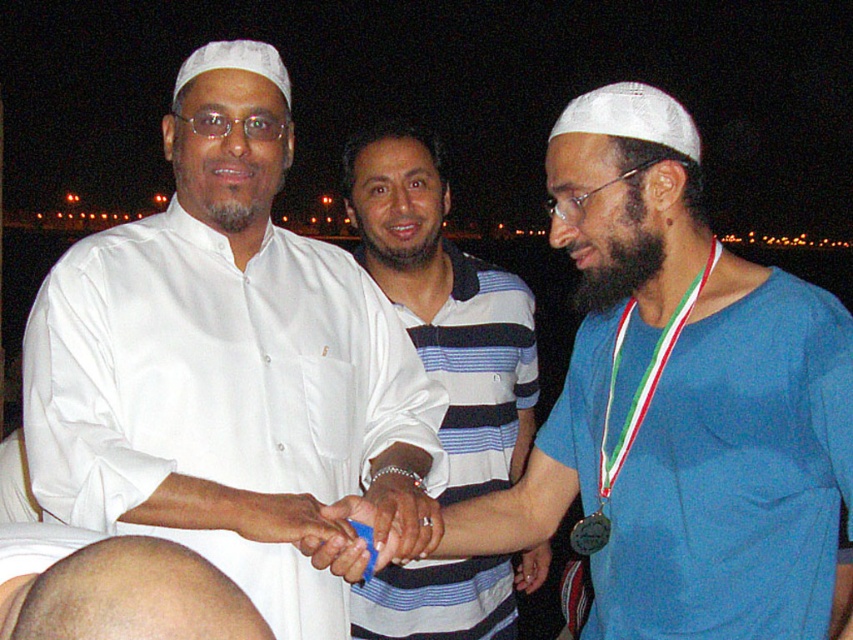
Can you confirm if blue cotton shirt at right is positioned above white matte hand at center?

Yes, blue cotton shirt at right is above white matte hand at center.

The height and width of the screenshot is (640, 853). Describe the element at coordinates (712, 464) in the screenshot. I see `blue cotton shirt at right` at that location.

Locate an element on the screen. This screenshot has width=853, height=640. blue cotton shirt at right is located at coordinates (712, 464).

Can you confirm if white satin shirt at center is thinner than bald head at lower left?

No, white satin shirt at center is not thinner than bald head at lower left.

Which is below, white satin shirt at center or bald head at lower left?

bald head at lower left is lower down.

Does point (54, 451) come behind point (3, 572)?

Yes.

The height and width of the screenshot is (640, 853). What are the coordinates of `white satin shirt at center` in the screenshot? It's located at (221, 356).

Which is more to the left, white satin shirt at center or blue cotton shirt at right?

white satin shirt at center

Can you confirm if white satin shirt at center is smaller than blue cotton shirt at right?

Actually, white satin shirt at center might be larger than blue cotton shirt at right.

Find the location of `white satin shirt at center`. white satin shirt at center is located at coordinates (221, 356).